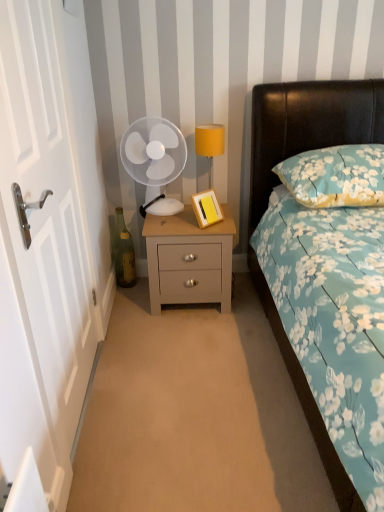
The width and height of the screenshot is (384, 512). Identify the location of matte gray nightstand at center. (189, 260).

From a real-world perspective, is matte gray nightstand at center located higher than floral fabric pillow at upper right?

No.

Is matte gray nightstand at center turned away from floral fabric pillow at upper right?

No, floral fabric pillow at upper right is not at the back of matte gray nightstand at center.

Does matte gray nightstand at center lie in front of floral fabric pillow at upper right?

No, matte gray nightstand at center is behind floral fabric pillow at upper right.

Is matte gray nightstand at center bigger than floral fabric pillow at upper right?

Yes, matte gray nightstand at center is bigger than floral fabric pillow at upper right.

Which of these two, green glass bottle at left or white plastic mechanical fan at center, is bigger?

white plastic mechanical fan at center.

From a real-world perspective, is green glass bottle at left beneath white plastic mechanical fan at center?

Yes.

From the picture: Which is closer to the camera, (125, 234) or (157, 160)?

The point (157, 160) is more forward.

I want to click on bottle that is behind the white plastic mechanical fan at center, so click(x=123, y=252).

Is floral fabric pillow at upper right smaller than floral fabric bed at right?

Yes.

From the image's perspective, who appears lower, floral fabric pillow at upper right or floral fabric bed at right?

floral fabric bed at right, from the image's perspective.

Could floral fabric bed at right be considered to be inside floral fabric pillow at upper right?

That's incorrect, floral fabric bed at right is not inside floral fabric pillow at upper right.

Which is nearer, (316, 182) or (269, 93)?

Point (316, 182) is positioned closer to the camera compared to point (269, 93).

Is white wooden door at left taller or shorter than floral fabric pillow at upper right?

white wooden door at left is taller than floral fabric pillow at upper right.

Is point (46, 179) farther from camera compared to point (368, 193)?

That is False.

Based on their sizes in the image, would you say white wooden door at left is bigger or smaller than floral fabric pillow at upper right?

Clearly, white wooden door at left is larger in size than floral fabric pillow at upper right.

Considering the positions of point (140, 140) and point (295, 193), is point (140, 140) closer or farther from the camera than point (295, 193)?

Point (140, 140) is farther from the camera than point (295, 193).

Considering the sizes of white plastic mechanical fan at center and floral fabric pillow at upper right in the image, is white plastic mechanical fan at center wider or thinner than floral fabric pillow at upper right?

white plastic mechanical fan at center is thinner than floral fabric pillow at upper right.

Looking at this image, does white plastic mechanical fan at center lie behind floral fabric pillow at upper right?

Yes, white plastic mechanical fan at center is behind floral fabric pillow at upper right.

From a real-world perspective, is yellow fabric lampshade at upper right positioned under floral fabric bed at right based on gravity?

Actually, yellow fabric lampshade at upper right is physically above floral fabric bed at right in the real world.

Would you say yellow fabric lampshade at upper right is outside floral fabric bed at right?

Yes.

Is point (218, 137) farther from viewer compared to point (258, 205)?

No, (218, 137) is closer to viewer.

In order to click on nightstand on the left of yellow fabric lampshade at upper right in this screenshot , I will do `click(189, 260)`.

Is yellow fabric lampshade at upper right at the back of matte gray nightstand at center?

No, matte gray nightstand at center is not facing away from yellow fabric lampshade at upper right.

Can you confirm if matte gray nightstand at center is thinner than yellow fabric lampshade at upper right?

No.

Are matte gray nightstand at center and yellow fabric lampshade at upper right located far from each other?

No, matte gray nightstand at center is in close proximity to yellow fabric lampshade at upper right.

Locate an element on the screen. Image resolution: width=384 pixels, height=512 pixels. nightstand that appears below the floral fabric pillow at upper right (from the image's perspective) is located at coordinates (189, 260).

Find the location of a particular element. mechanical fan that appears above the green glass bottle at left (from the image's perspective) is located at coordinates (153, 151).

When comparing their distances from green glass bottle at left, does white wooden door at left or yellow fabric lampshade at upper right seem further?

Based on the image, white wooden door at left appears to be further to green glass bottle at left.

Looking at the image, which one is located closer to matte gray nightstand at center, green glass bottle at left or floral fabric bed at right?

floral fabric bed at right lies closer to matte gray nightstand at center than the other object.

Estimate the real-world distances between objects in this image. Which object is closer to yellow fabric lampshade at upper right, white wooden door at left or floral fabric bed at right?

The object closer to yellow fabric lampshade at upper right is floral fabric bed at right.

Based on their spatial positions, is yellow fabric lampshade at upper right or floral fabric bed at right further from white plastic mechanical fan at center?

floral fabric bed at right is further to white plastic mechanical fan at center.

Based on their spatial positions, is yellow fabric lampshade at upper right or white wooden door at left closer to floral fabric bed at right?

yellow fabric lampshade at upper right lies closer to floral fabric bed at right than the other object.

Based on their spatial positions, is white plastic mechanical fan at center or yellow fabric lampshade at upper right closer to matte gray nightstand at center?

→ Based on the image, white plastic mechanical fan at center appears to be nearer to matte gray nightstand at center.

From the image, which object appears to be nearer to yellow fabric lampshade at upper right, matte gray nightstand at center or floral fabric pillow at upper right?

The object closer to yellow fabric lampshade at upper right is matte gray nightstand at center.

Looking at the image, which one is located closer to white plastic mechanical fan at center, green glass bottle at left or floral fabric pillow at upper right?

Among the two, green glass bottle at left is located nearer to white plastic mechanical fan at center.

Image resolution: width=384 pixels, height=512 pixels. Find the location of `pillow between white wooden door at left and floral fabric bed at right`. pillow between white wooden door at left and floral fabric bed at right is located at coordinates (335, 176).

In order to click on nightstand between floral fabric bed at right and yellow fabric lampshade at upper right in the front-back direction in this screenshot , I will do `click(189, 260)`.

Identify the location of door positioned between floral fabric bed at right and yellow fabric lampshade at upper right from near to far. (49, 237).

The width and height of the screenshot is (384, 512). Find the location of `mechanical fan situated between green glass bottle at left and floral fabric pillow at upper right from left to right`. mechanical fan situated between green glass bottle at left and floral fabric pillow at upper right from left to right is located at coordinates (153, 151).